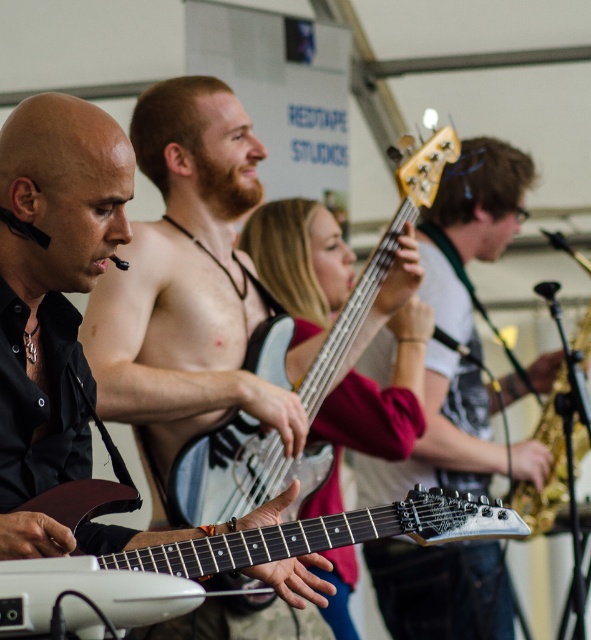
You are a stagehand setting up equipment for a band. You need to place the matte white bass guitar at center and the white matte electric guitar at center on a stage that has limited space. Based on the description, which guitar requires more space due to its size?

The matte white bass guitar at center requires more space because it is larger in size than the white matte electric guitar at center.

You are a stagehand setting up equipment. You need to place a 36 inch long amplifier between the white matte electric guitar at center and the white glossy electric guitar at center. Is there enough space between them to fit the amplifier?

The white matte electric guitar at center is 37.06 inches away from white glossy electric guitar at center. Since the amplifier is 36 inches long, there is enough space to fit it between them.